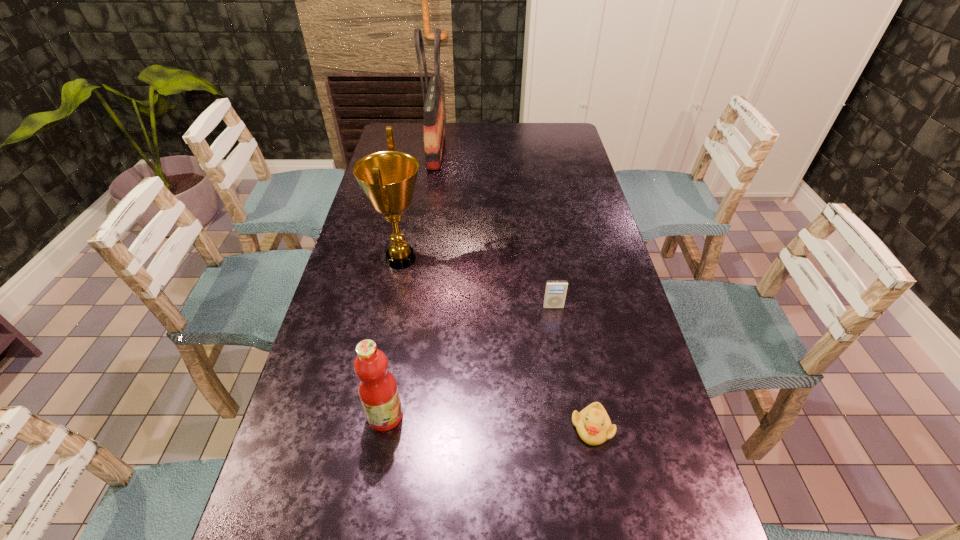
At what (x,y) coordinates should I click in order to perform the action: click on shopping bag. Please return your answer as a coordinate pair (x, y). Looking at the image, I should click on (434, 130).

This screenshot has width=960, height=540. I want to click on the farthest object, so click(434, 130).

Locate an element on the screen. award is located at coordinates (388, 178).

You are a GUI agent. You are given a task and a screenshot of the screen. Output one action in this format:
    pyautogui.click(x=<x>, y=<y>)
    Task: Click on the second farthest object
    The height and width of the screenshot is (540, 960).
    Given the screenshot: What is the action you would take?
    pyautogui.click(x=388, y=178)

This screenshot has height=540, width=960. I want to click on the third tallest object, so click(x=377, y=388).

The width and height of the screenshot is (960, 540). Find the location of `the second shortest object`. the second shortest object is located at coordinates (555, 292).

Where is `the third nearest object`? the third nearest object is located at coordinates (555, 292).

This screenshot has width=960, height=540. What are the coordinates of `duckling` in the screenshot? It's located at (593, 425).

This screenshot has width=960, height=540. In order to click on vacant area situated 0.070m on the front-facing side of the tallest object in this screenshot , I will do `click(464, 151)`.

Where is `vacant space located 0.100m on the front view with handles of the award`? Image resolution: width=960 pixels, height=540 pixels. vacant space located 0.100m on the front view with handles of the award is located at coordinates (461, 259).